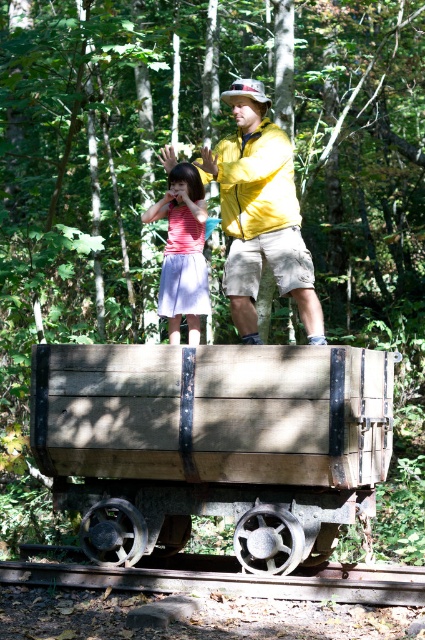
Is point (319, 371) positioned after point (234, 244)?

That is False.

Image resolution: width=425 pixels, height=640 pixels. Find the location of `wooden wagon at center`. wooden wagon at center is located at coordinates [212, 442].

Can you confirm if wooden wagon at center is smaller than brown wooden train track at bottom?

No, wooden wagon at center is not smaller than brown wooden train track at bottom.

Is wooden wagon at center further to the viewer compared to brown wooden train track at bottom?

That is True.

Find the location of `wooden wagon at center`. wooden wagon at center is located at coordinates (212, 442).

Does yellow matte jacket at upper center lie in front of brown wooden train track at bottom?

No, it is not.

Does yellow matte jacket at upper center appear on the right side of brown wooden train track at bottom?

Correct, you'll find yellow matte jacket at upper center to the right of brown wooden train track at bottom.

Measure the distance between yellow matte jacket at upper center and camera.

The distance of yellow matte jacket at upper center from camera is 7.49 meters.

This screenshot has width=425, height=640. In order to click on yellow matte jacket at upper center in this screenshot , I will do `click(260, 212)`.